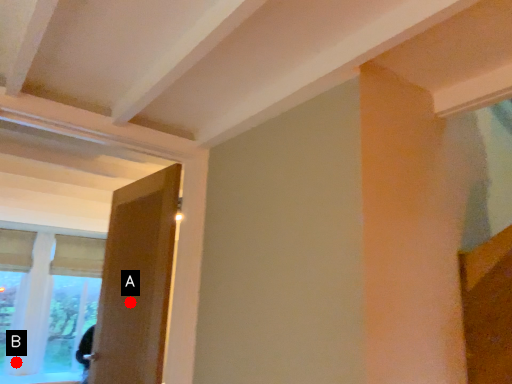
Question: Two points are circled on the image, labeled by A and B beside each circle. Which point appears closest to the camera in this image?

Choices:
 (A) A is closer
 (B) B is closer

Answer: (A)